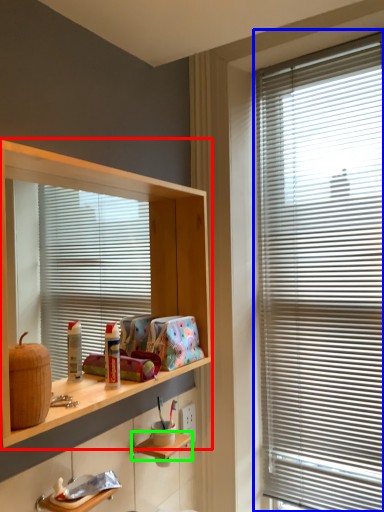
Question: Estimate the real-world distances between objects in this image. Which object is farther from shelf (highlighted by a red box), window blind (highlighted by a blue box) or shelf (highlighted by a green box)?

Choices:
 (A) window blind
 (B) shelf

Answer: (B)